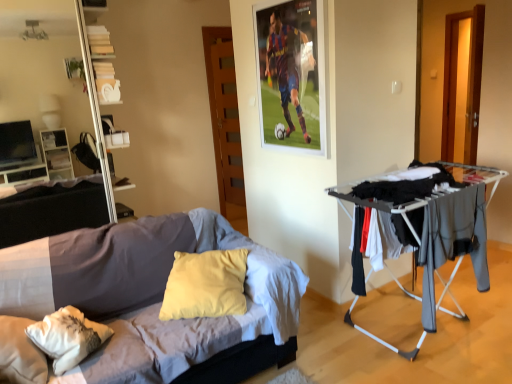
Question: Considering the relative sizes of white glossy bookshelf at upper left and white glossy entertainment center at left in the image provided, is white glossy bookshelf at upper left wider than white glossy entertainment center at left?

Choices:
 (A) no
 (B) yes

Answer: (B)

Question: Considering the relative sizes of white glossy bookshelf at upper left and white glossy entertainment center at left in the image provided, is white glossy bookshelf at upper left thinner than white glossy entertainment center at left?

Choices:
 (A) yes
 (B) no

Answer: (B)

Question: Are white glossy bookshelf at upper left and white glossy entertainment center at left making contact?

Choices:
 (A) yes
 (B) no

Answer: (B)

Question: From the image's perspective, is white glossy bookshelf at upper left under white glossy entertainment center at left?

Choices:
 (A) no
 (B) yes

Answer: (A)

Question: Does white glossy bookshelf at upper left lie in front of white glossy entertainment center at left?

Choices:
 (A) no
 (B) yes

Answer: (A)

Question: Which is correct: white glossy entertainment center at left is inside white glossy bookshelf at upper left, or outside of it?

Choices:
 (A) inside
 (B) outside

Answer: (B)

Question: Is point (38, 81) positioned closer to the camera than point (79, 31)?

Choices:
 (A) closer
 (B) farther

Answer: (B)

Question: Looking at the image, does white glossy entertainment center at left seem bigger or smaller compared to white glossy bookshelf at upper left?

Choices:
 (A) big
 (B) small

Answer: (B)

Question: Is white glossy entertainment center at left to the left or to the right of white glossy bookshelf at upper left in the image?

Choices:
 (A) right
 (B) left

Answer: (B)

Question: Considering their positions, is white glossy bookshelf at upper left located in front of or behind white glossy entertainment center at left?

Choices:
 (A) behind
 (B) front

Answer: (A)

Question: In terms of width, does white glossy bookshelf at upper left look wider or thinner when compared to white glossy entertainment center at left?

Choices:
 (A) wide
 (B) thin

Answer: (A)

Question: Is white glossy bookshelf at upper left spatially inside white glossy entertainment center at left, or outside of it?

Choices:
 (A) inside
 (B) outside

Answer: (B)

Question: From the image's perspective, relative to white glossy entertainment center at left, is white glossy bookshelf at upper left above or below?

Choices:
 (A) above
 (B) below

Answer: (A)

Question: Visually, is white glossy bookshelf at upper left positioned to the left or to the right of soft cotton bed at center?

Choices:
 (A) right
 (B) left

Answer: (B)

Question: Is white glossy bookshelf at upper left taller or shorter than soft cotton bed at center?

Choices:
 (A) tall
 (B) short

Answer: (A)